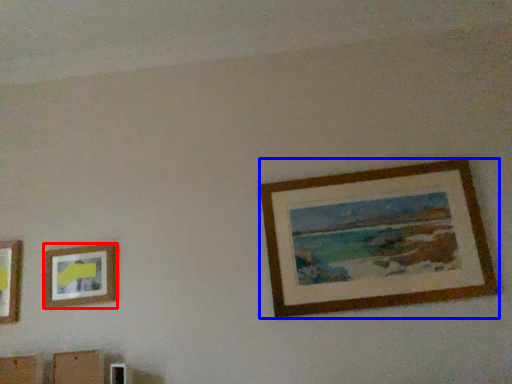
Question: Which of the following is the closest to the observer, picture frame (highlighted by a red box) or picture frame (highlighted by a blue box)?

Choices:
 (A) picture frame
 (B) picture frame

Answer: (B)